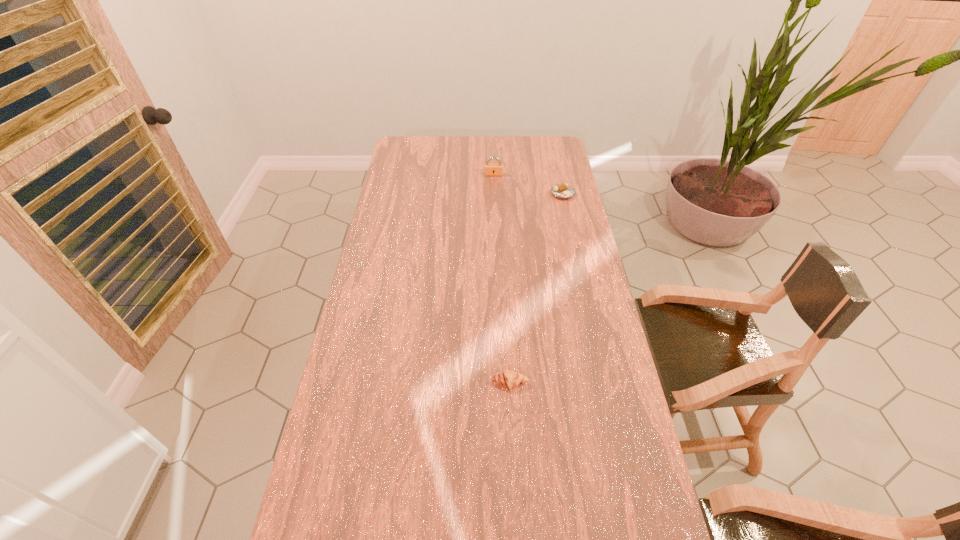
I want to click on the farthest object, so click(490, 169).

Identify the location of padlock. (490, 169).

Locate an element on the screen. the nearest object is located at coordinates (509, 379).

Locate an element on the screen. The height and width of the screenshot is (540, 960). the nearer pastry is located at coordinates (509, 379).

Where is `the right pastry`? This screenshot has width=960, height=540. the right pastry is located at coordinates (563, 191).

At what (x,y) coordinates should I click in order to perform the action: click on the second farthest object. Please return your answer as a coordinate pair (x, y). This screenshot has height=540, width=960. Looking at the image, I should click on (563, 191).

Find the location of `blank area located to unlock the tallest object from the front`. blank area located to unlock the tallest object from the front is located at coordinates (494, 191).

Where is `free space located on the front-facing side of the left pastry`? free space located on the front-facing side of the left pastry is located at coordinates (515, 467).

At what (x,y) coordinates should I click in order to perform the action: click on vacant region located on the front of the farther pastry. Please return your answer as a coordinate pair (x, y). Image resolution: width=960 pixels, height=540 pixels. Looking at the image, I should click on (568, 218).

The width and height of the screenshot is (960, 540). In order to click on object located at the right edge in this screenshot , I will do `click(563, 191)`.